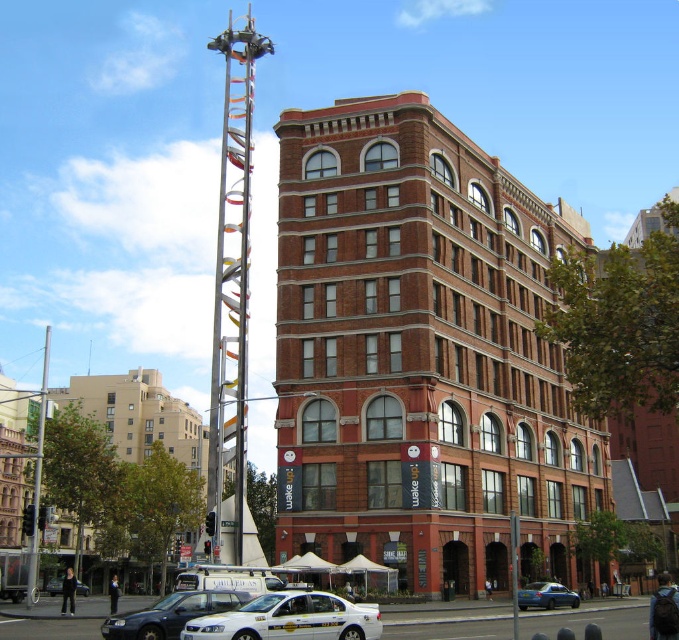
Which is more to the right, brown brick building at center or silver metallic pole at left?

brown brick building at center

Is brown brick building at center to the right of silver metallic pole at left from the viewer's perspective?

Indeed, brown brick building at center is positioned on the right side of silver metallic pole at left.

At what (x,y) coordinates should I click in order to perform the action: click on brown brick building at center. Please return your answer as a coordinate pair (x, y). Looking at the image, I should click on (422, 353).

This screenshot has width=679, height=640. In order to click on brown brick building at center in this screenshot , I will do `click(422, 353)`.

Does blue metallic sedan at lower center appear under metallic silver taxi at lower left?

Incorrect, blue metallic sedan at lower center is not positioned below metallic silver taxi at lower left.

Identify the location of blue metallic sedan at lower center. (547, 595).

Identify the location of blue metallic sedan at lower center. (547, 595).

Is silver metallic pole at left behind metallic silver taxi at lower left?

No.

In the scene shown: Between silver metallic pole at left and metallic silver taxi at lower left, which one is positioned higher?

silver metallic pole at left is higher up.

Who is more forward, (45,333) or (54,584)?

Positioned in front is point (54,584).

At what (x,y) coordinates should I click in order to perform the action: click on silver metallic pole at left. Please return your answer as a coordinate pair (x, y). Looking at the image, I should click on 37,476.